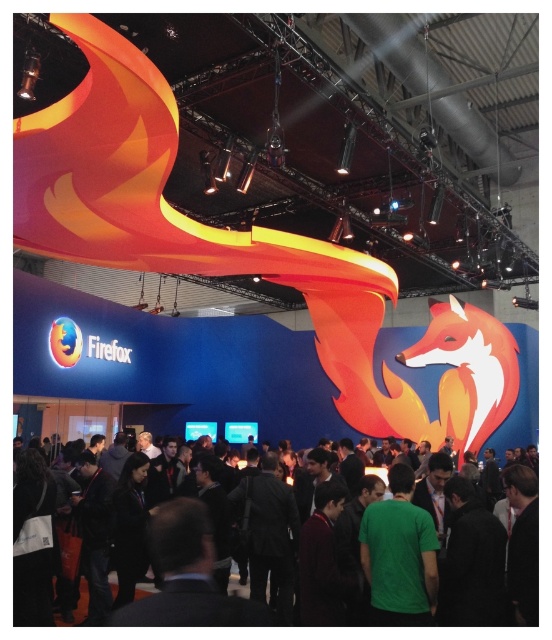
Question: Can you confirm if green matte shirt at center is thinner than green fabric shirt at center?

Choices:
 (A) yes
 (B) no

Answer: (B)

Question: Is green matte shirt at center to the left of green fabric shirt at center from the viewer's perspective?

Choices:
 (A) yes
 (B) no

Answer: (B)

Question: Which object is closer to the camera taking this photo?

Choices:
 (A) green fabric shirt at center
 (B) green matte shirt at center

Answer: (B)

Question: Is green matte shirt at center to the left of green fabric shirt at center from the viewer's perspective?

Choices:
 (A) yes
 (B) no

Answer: (B)